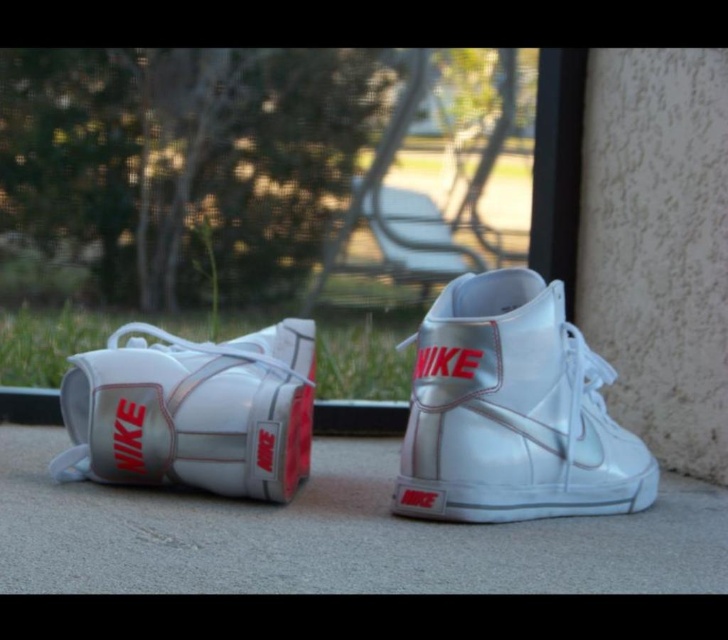
You are standing in front of the sneakers and want to place a small sticker between them. Which sneaker should you position the sticker closer to, the metallic white sneaker at center or the metallic white sneaker at left?

The metallic white sneaker at center is above the metallic white sneaker at left, so to place the sticker between them, you should position it closer to the metallic white sneaker at left since it is lower.